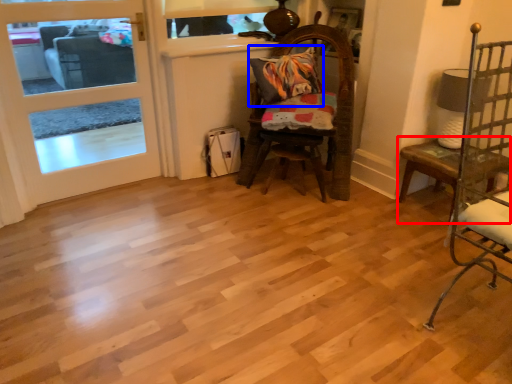
Question: Which object is further to the camera taking this photo, table (highlighted by a red box) or pillow (highlighted by a blue box)?

Choices:
 (A) table
 (B) pillow

Answer: (B)